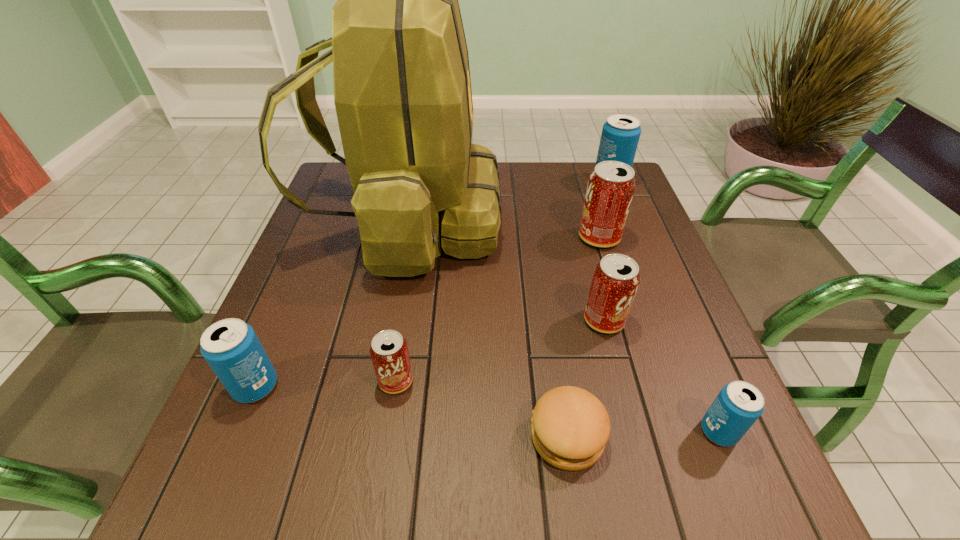
You are a GUI agent. You are given a task and a screenshot of the screen. Output one action in this format:
    pyautogui.click(x=<x>, y=<y>)
    Task: Click on the free spot located on the left of the fifth soda can from right to left
    This screenshot has width=960, height=540.
    Given the screenshot: What is the action you would take?
    pyautogui.click(x=347, y=381)

The width and height of the screenshot is (960, 540). What are the coordinates of `free region located 0.170m on the back of the smallest blue soda can` in the screenshot? It's located at (681, 338).

Locate an element on the screen. The image size is (960, 540). vacant point located on the back of the shortest object is located at coordinates (552, 333).

At what (x,y) coordinates should I click in order to perform the action: click on backpack that is at the far edge. Please return your answer as a coordinate pair (x, y). The width and height of the screenshot is (960, 540). Looking at the image, I should click on (402, 90).

Where is `soda can located in the far edge section of the desktop`? The height and width of the screenshot is (540, 960). soda can located in the far edge section of the desktop is located at coordinates (620, 135).

You are a GUI agent. You are given a task and a screenshot of the screen. Output one action in this format:
    pyautogui.click(x=<x>, y=<y>)
    Task: Click on the object that is at the near edge
    This screenshot has height=540, width=960.
    Given the screenshot: What is the action you would take?
    pyautogui.click(x=570, y=427)

Where is `backpack located at the left edge`? Image resolution: width=960 pixels, height=540 pixels. backpack located at the left edge is located at coordinates (402, 90).

I want to click on soda can that is at the left edge, so click(231, 347).

This screenshot has width=960, height=540. In order to click on object present at the far left corner in this screenshot , I will do `click(402, 90)`.

Locate an element on the screen. object that is at the far right corner is located at coordinates (620, 135).